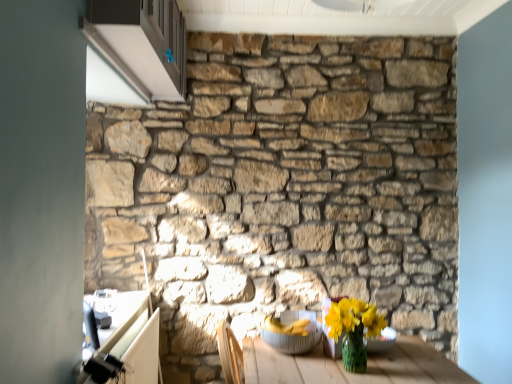
Where is `blank space situated above natural stone wall at center (from a real-world perspective)`? blank space situated above natural stone wall at center (from a real-world perspective) is located at coordinates (307, 31).